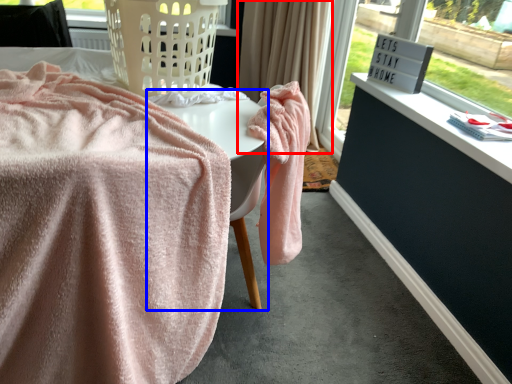
Question: Among these objects, which one is farthest to the camera, curtain (highlighted by a red box) or table (highlighted by a blue box)?

Choices:
 (A) curtain
 (B) table

Answer: (A)